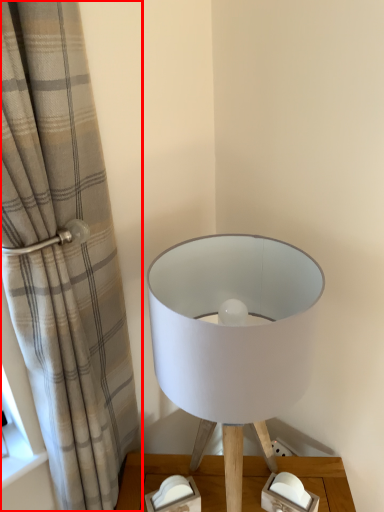
Question: From the image's perspective, what is the correct spatial relationship of curtain (annotated by the red box) in relation to lamp?

Choices:
 (A) above
 (B) below

Answer: (A)